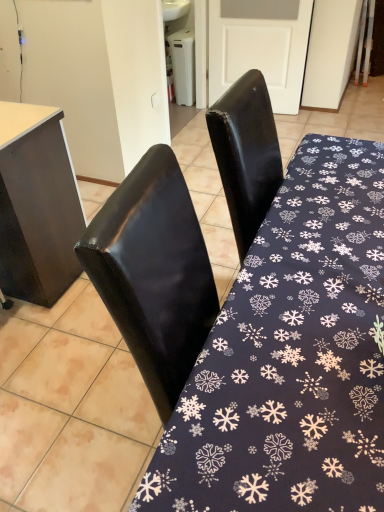
What are the coordinates of `dark blue fabric with snowflake pattern at center` in the screenshot? It's located at (291, 356).

Image resolution: width=384 pixels, height=512 pixels. What do you see at coordinates (291, 356) in the screenshot? I see `dark blue fabric with snowflake pattern at center` at bounding box center [291, 356].

Find the location of a particular element. dark blue fabric with snowflake pattern at center is located at coordinates (291, 356).